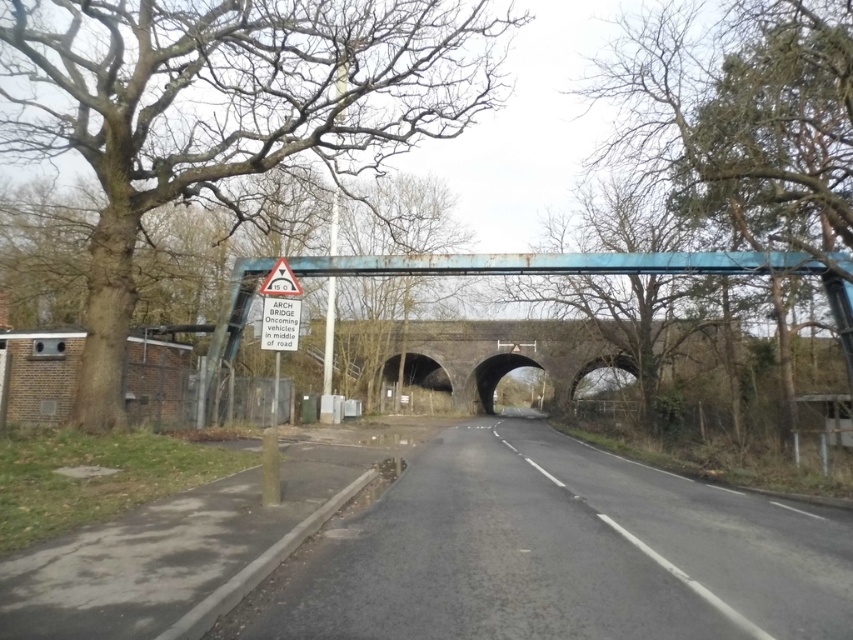
You are driving a truck that is 12 meters long. You need to cross the rusty metal bridge at center. The bridge is at coordinates 0.553, 0.564. Can your truck safely cross the bridge if the maximum allowed length for vehicles on this bridge is 10 meters?

The rusty metal bridge at center has a maximum allowed vehicle length of 10 meters. Since your truck is 12 meters long, it exceeds the limit, so it cannot safely cross the bridge.

You are a driver approaching the arch bridge on the road. You see a bare wood tree at left. Where is the tree located in relation to the road?

The bare wood tree at left is located at the left side of the road, partially obscuring a small brick structure. It is positioned at coordinates approximately 0.172 on the x and 0.264 on the y axis according to the image coordinate system.